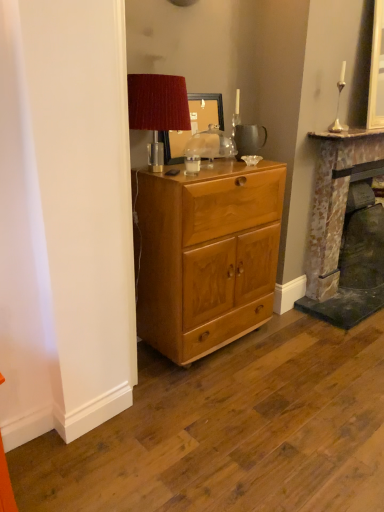
Question: Considering their positions, is velvet red lampshade at upper center located in front of or behind silver metallic candle holder at upper right?

Choices:
 (A) behind
 (B) front

Answer: (B)

Question: Is velvet red lampshade at upper center taller or shorter than silver metallic candle holder at upper right?

Choices:
 (A) short
 (B) tall

Answer: (B)

Question: Based on their relative distances, which object is farther from the light brown wood cabinet at center?

Choices:
 (A) velvet red lampshade at upper center
 (B) wooden picture frame at center
 (C) silver metallic candle holder at upper right
 (D) rustic stone fireplace at right

Answer: (C)

Question: Based on their relative distances, which object is farther from the wooden picture frame at center?

Choices:
 (A) rustic stone fireplace at right
 (B) velvet red lampshade at upper center
 (C) light brown wood cabinet at center
 (D) silver metallic candle holder at upper right

Answer: (A)